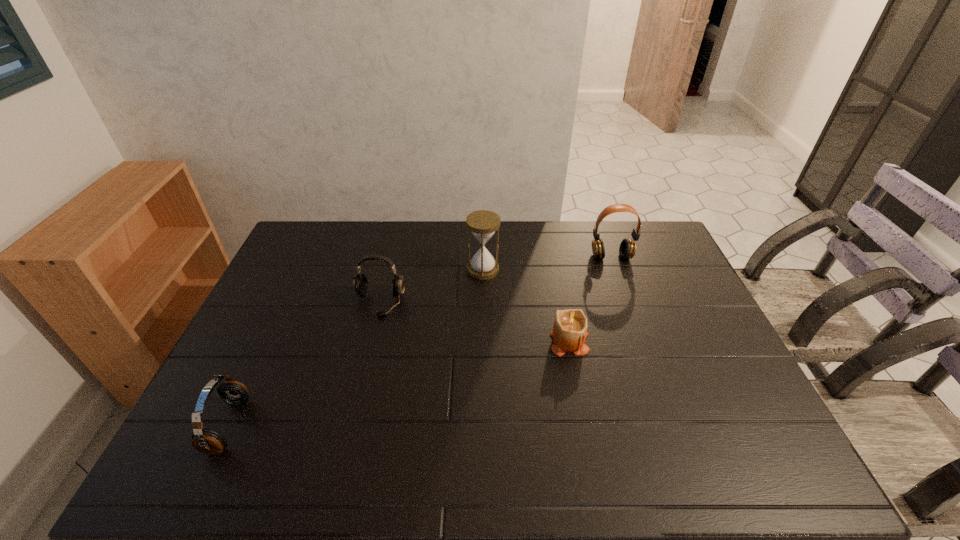
Locate an element on the screen. The image size is (960, 540). free spot located 0.270m on the ear cups of the rightmost headset is located at coordinates (634, 319).

Image resolution: width=960 pixels, height=540 pixels. In order to click on free point located 0.190m with the microphone on the side of the second headset from left to right in this screenshot , I will do `click(364, 369)`.

Identify the location of free space located 0.160m on the ear cups of the leftmost object. The height and width of the screenshot is (540, 960). (308, 426).

This screenshot has width=960, height=540. In order to click on vacant space located 0.080m on the front of the second object from right to left in this screenshot , I will do `click(578, 381)`.

Locate an element on the screen. Image resolution: width=960 pixels, height=540 pixels. hourglass present at the far edge is located at coordinates (482, 223).

Where is `headset at the far edge`? This screenshot has width=960, height=540. headset at the far edge is located at coordinates (627, 249).

Where is `object at the near edge`? The image size is (960, 540). object at the near edge is located at coordinates coord(208,441).

Where is `object that is positioned at the left edge`? This screenshot has height=540, width=960. object that is positioned at the left edge is located at coordinates (208, 441).

Where is `object located at the right edge`? Image resolution: width=960 pixels, height=540 pixels. object located at the right edge is located at coordinates (627, 249).

The image size is (960, 540). Identify the location of object located at the near left corner. (208, 441).